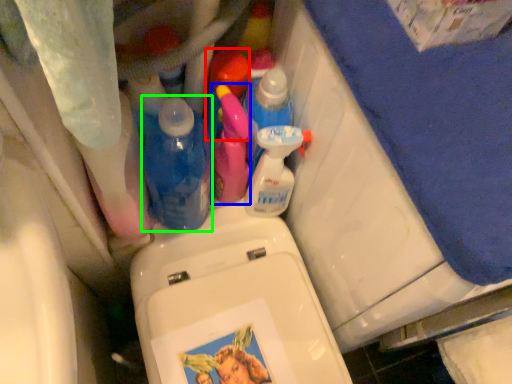
Question: Considering the real-world distances, which object is closest to cleaning product (highlighted by a red box)? cleaning product (highlighted by a blue box) or bottle (highlighted by a green box).

Choices:
 (A) cleaning product
 (B) bottle

Answer: (A)